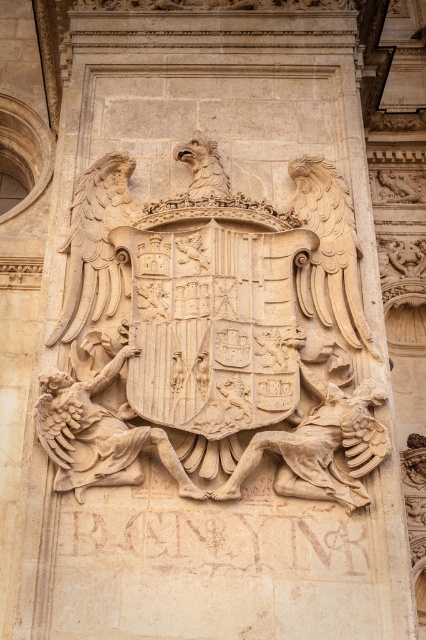
You are an art conservator examining the stone carving. The carved stone coat of arms at center and the beige stone figure at center are both part of the same historical monument. Based on their sizes, which object would require more material to create?

The carved stone coat of arms at center is much taller than the beige stone figure at center, so it would require more material to create.

You are an architect examining the facade of a historical building. You notice two stone carvings on the facade. The first is the carved stone coat of arms at center, and the second is the beige stone warrior at center. Based on their positions, which carving appears larger in size?

The carved stone coat of arms at center appears larger in size because it has a greater height compared to the beige stone warrior at center.

Based on the photo, you are an architect examining the stone carving on the building facade. The coordinates provided indicate the position of the carved stone coat of arms at center. If you were to draw a vertical line through point (213, 336), which quadrant of the emblem would this line pass through?

The vertical line drawn through point (213, 336) would pass through the central shield of the carved stone coat of arms at center, as this point represents the center of the emblem.